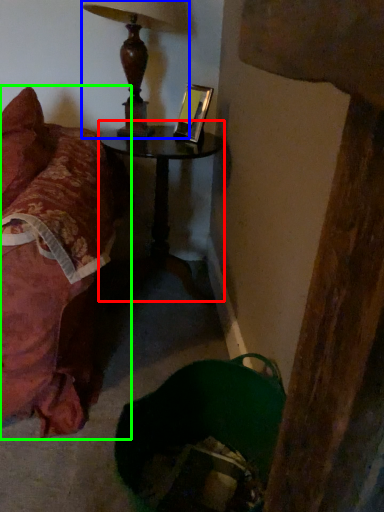
Question: Estimate the real-world distances between objects in this image. Which object is closer to table (highlighted by a red box), lamp (highlighted by a blue box) or furniture (highlighted by a green box)?

Choices:
 (A) lamp
 (B) furniture

Answer: (A)